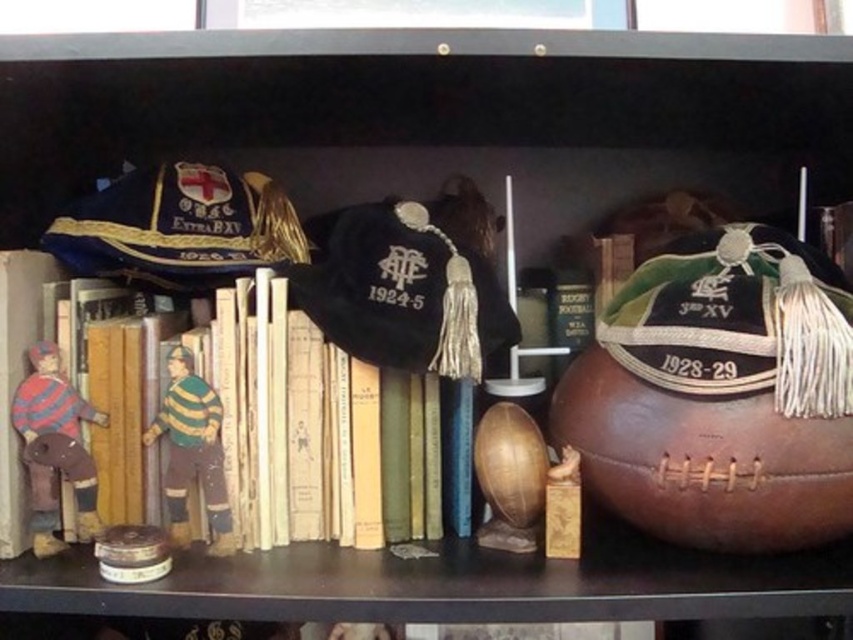
Does velvet green cap at right have a lesser height compared to yellow paper book at center?

Indeed, velvet green cap at right has a lesser height compared to yellow paper book at center.

Does velvet green cap at right come in front of yellow paper book at center?

That is True.

The image size is (853, 640). Identify the location of velvet green cap at right. (737, 321).

Is yellow paper book at center taller than wooden painted figure at center?

Yes, yellow paper book at center is taller than wooden painted figure at center.

Who is higher up, yellow paper book at center or wooden painted figure at center?

yellow paper book at center is above.

Between point (357, 518) and point (172, 378), which one is positioned in front?

Point (172, 378)

I want to click on yellow paper book at center, so (289, 420).

Between blue velvet cap at upper left and striped fabric figure at left, which one has less height?

Standing shorter between the two is blue velvet cap at upper left.

Is point (225, 202) in front of point (36, 556)?

No, it is not.

Measure the distance between blue velvet cap at upper left and camera.

The distance of blue velvet cap at upper left from camera is 31.15 inches.

This screenshot has height=640, width=853. Find the location of `blue velvet cap at upper left`. blue velvet cap at upper left is located at coordinates (178, 227).